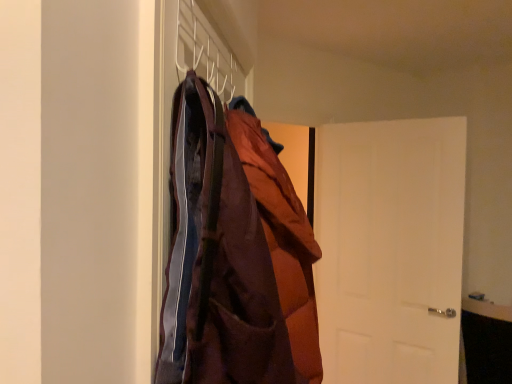
Question: From the image's perspective, is white matte door at right beneath white matte coat hanger at upper center?

Choices:
 (A) no
 (B) yes

Answer: (B)

Question: Considering the relative sizes of white matte door at right and white matte coat hanger at upper center in the image provided, is white matte door at right bigger than white matte coat hanger at upper center?

Choices:
 (A) no
 (B) yes

Answer: (B)

Question: From a real-world perspective, is white matte door at right positioned over white matte coat hanger at upper center based on gravity?

Choices:
 (A) yes
 (B) no

Answer: (B)

Question: Is white matte door at right thinner than white matte coat hanger at upper center?

Choices:
 (A) yes
 (B) no

Answer: (B)

Question: Can we say white matte door at right lies outside white matte coat hanger at upper center?

Choices:
 (A) yes
 (B) no

Answer: (A)

Question: From the image's perspective, is brown quilted jacket at center positioned above or below white matte coat hanger at upper center?

Choices:
 (A) above
 (B) below

Answer: (B)

Question: Is brown quilted jacket at center spatially inside white matte coat hanger at upper center, or outside of it?

Choices:
 (A) inside
 (B) outside

Answer: (B)

Question: Is brown quilted jacket at center bigger or smaller than white matte coat hanger at upper center?

Choices:
 (A) big
 (B) small

Answer: (A)

Question: Looking at their shapes, would you say brown quilted jacket at center is wider or thinner than white matte coat hanger at upper center?

Choices:
 (A) wide
 (B) thin

Answer: (A)

Question: Considering the positions of white matte door at right and brown quilted jacket at center in the image, is white matte door at right bigger or smaller than brown quilted jacket at center?

Choices:
 (A) big
 (B) small

Answer: (A)

Question: Looking at their shapes, would you say white matte door at right is wider or thinner than brown quilted jacket at center?

Choices:
 (A) thin
 (B) wide

Answer: (A)

Question: Considering the positions of point (452, 140) and point (276, 208), is point (452, 140) closer or farther from the camera than point (276, 208)?

Choices:
 (A) farther
 (B) closer

Answer: (A)

Question: From their relative heights in the image, would you say white matte door at right is taller or shorter than brown quilted jacket at center?

Choices:
 (A) short
 (B) tall

Answer: (B)

Question: Would you say white matte coat hanger at upper center is to the left or to the right of white matte door at right in the picture?

Choices:
 (A) right
 (B) left

Answer: (B)

Question: From their relative heights in the image, would you say white matte coat hanger at upper center is taller or shorter than white matte door at right?

Choices:
 (A) tall
 (B) short

Answer: (B)